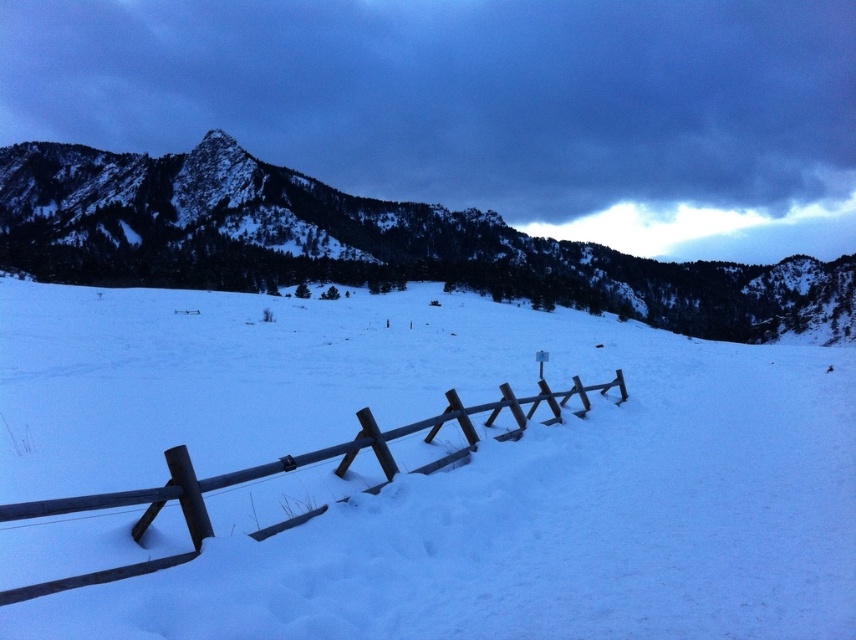
Based on the scene described, which object occupies more horizontal space in the image? Please consider the snowy rocky mountain at upper left and the brown wooden fence at lower center in your answer.

The snowy rocky mountain at upper left might be wider than the brown wooden fence at lower center according to the description.

You are standing in the winter landscape and want to walk towards the brown wooden fence at lower center. Which direction should you move relative to the white matte snow at center?

To reach the brown wooden fence at lower center from the white matte snow at center, you should move to the right since the white matte snow at center is to the left of the brown wooden fence at lower center.